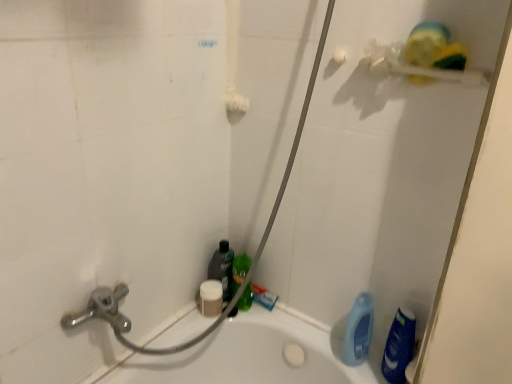
Question: Would you say white matte sponge at lower center, the 5th cleaning product when ordered from right to left, is outside blue glossy bottle at lower right, the first cleaning product in the right-to-left sequence?

Choices:
 (A) yes
 (B) no

Answer: (A)

Question: Could you tell me if white matte sponge at lower center, the 5th cleaning product when ordered from right to left, is facing blue glossy bottle at lower right, the first cleaning product in the right-to-left sequence?

Choices:
 (A) yes
 (B) no

Answer: (A)

Question: Is white matte sponge at lower center, arranged as the 1th cleaning product when viewed from the left, looking in the opposite direction of blue glossy bottle at lower right, the first cleaning product in the right-to-left sequence?

Choices:
 (A) no
 (B) yes

Answer: (A)

Question: From the image's perspective, would you say white matte sponge at lower center, arranged as the 1th cleaning product when viewed from the left, is shown under blue glossy bottle at lower right, placed as the 5th cleaning product when sorted from left to right?

Choices:
 (A) no
 (B) yes

Answer: (A)

Question: From the image's perspective, is white matte sponge at lower center, the 5th cleaning product when ordered from right to left, on top of blue glossy bottle at lower right, the first cleaning product in the right-to-left sequence?

Choices:
 (A) yes
 (B) no

Answer: (A)

Question: Is white matte sponge at lower center, the 5th cleaning product when ordered from right to left, inside or outside of yellow sponge at upper right?

Choices:
 (A) outside
 (B) inside

Answer: (A)

Question: From a real-world perspective, is white matte sponge at lower center, arranged as the 1th cleaning product when viewed from the left, above or below yellow sponge at upper right?

Choices:
 (A) below
 (B) above

Answer: (A)

Question: Visually, is white matte sponge at lower center, arranged as the 1th cleaning product when viewed from the left, positioned to the left or to the right of yellow sponge at upper right?

Choices:
 (A) right
 (B) left

Answer: (B)

Question: In the image, is white matte sponge at lower center, arranged as the 1th cleaning product when viewed from the left, positioned in front of or behind yellow sponge at upper right?

Choices:
 (A) front
 (B) behind

Answer: (B)

Question: Based on their positions, is translucent plastic bottle at lower center, which ranks as the 4th cleaning product in right-to-left order, located to the left or right of white matte sponge at lower center, arranged as the 1th cleaning product when viewed from the left?

Choices:
 (A) left
 (B) right

Answer: (B)

Question: In terms of width, does translucent plastic bottle at lower center, which ranks as the second cleaning product in left-to-right order, look wider or thinner when compared to white matte sponge at lower center, the 5th cleaning product when ordered from right to left?

Choices:
 (A) thin
 (B) wide

Answer: (A)

Question: Relative to white matte sponge at lower center, the 5th cleaning product when ordered from right to left, is translucent plastic bottle at lower center, which ranks as the 4th cleaning product in right-to-left order, in front or behind?

Choices:
 (A) front
 (B) behind

Answer: (B)

Question: Is translucent plastic bottle at lower center, which ranks as the 4th cleaning product in right-to-left order, situated inside white matte sponge at lower center, arranged as the 1th cleaning product when viewed from the left, or outside?

Choices:
 (A) outside
 (B) inside

Answer: (A)

Question: In terms of size, does translucent plastic bottle at lower center, which ranks as the 4th cleaning product in right-to-left order, appear bigger or smaller than blue plastic bottle at lower right, acting as the 2th cleaning product starting from the right?

Choices:
 (A) big
 (B) small

Answer: (B)

Question: Is translucent plastic bottle at lower center, which ranks as the second cleaning product in left-to-right order, in front of or behind blue plastic bottle at lower right, acting as the 2th cleaning product starting from the right, in the image?

Choices:
 (A) front
 (B) behind

Answer: (B)